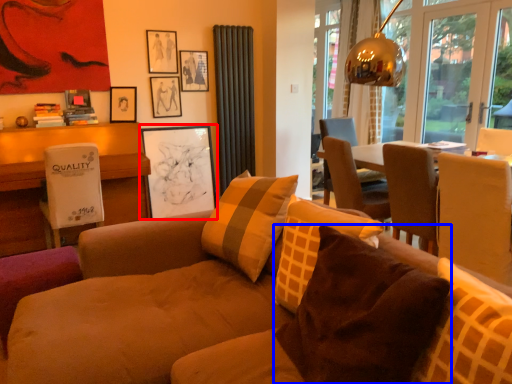
Question: Which point is further to the camera, picture frame (highlighted by a red box) or pillow (highlighted by a blue box)?

Choices:
 (A) picture frame
 (B) pillow

Answer: (A)